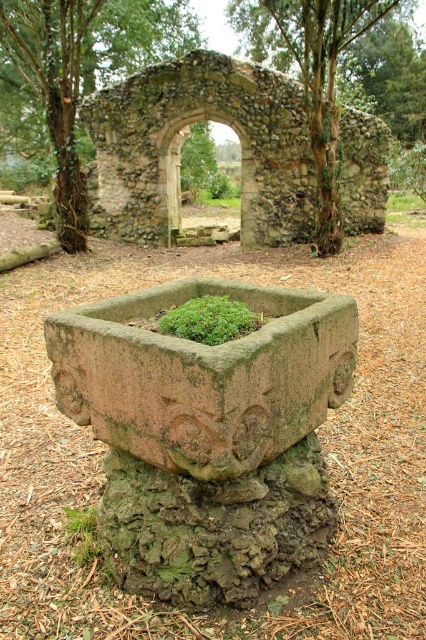
You are standing in the outdoor setting and want to take a photo of the green mossy stone at center and the green mossy stone arch at center. Which object should you position to the left side of your camera frame to include both in the shot?

You should position the green mossy stone at center to the left side of your camera frame since it is already to the left of the green mossy stone arch at center in the scene.

Based on the photo, you are standing in front of the green mossy stone at center and want to see the green mossy stone arch at center. Can you see it without moving your head?

The green mossy stone arch at center is behind the green mossy stone at center, so yes, you can see it without moving your head because it is positioned behind the stone in front of you.